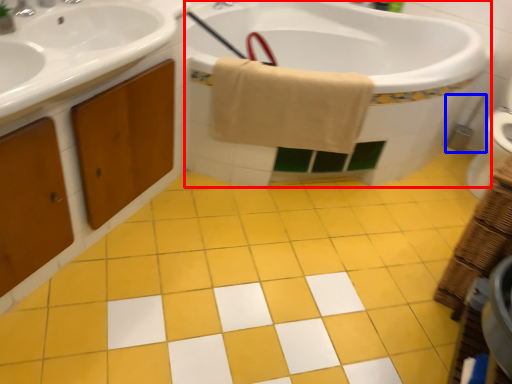
Question: Which object appears farthest to the camera in this image, bath (highlighted by a red box) or brush (highlighted by a blue box)?

Choices:
 (A) bath
 (B) brush

Answer: (B)